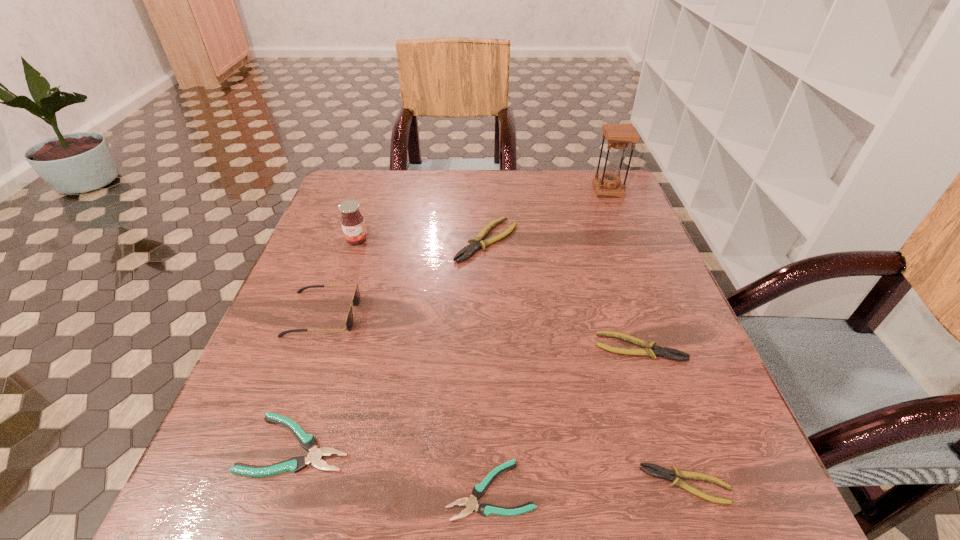
Locate an element on the screen. empty space between the left teal pliers and the nearest yellow pliers is located at coordinates (492, 464).

Identify the location of vacant space that is in between the tallest object and the smallest yellow pliers. (647, 338).

Find the location of a particular element. free spot between the jam and the second biggest yellow pliers is located at coordinates (498, 294).

I want to click on free point between the farthest object and the fourth shortest pliers, so click(624, 269).

You are a GUI agent. You are given a task and a screenshot of the screen. Output one action in this format:
    pyautogui.click(x=<x>, y=<y>)
    Task: Click on the free spot between the fourth tallest object and the jam
    The image size is (960, 540).
    Given the screenshot: What is the action you would take?
    pyautogui.click(x=421, y=240)

At what (x,y) coordinates should I click in order to perform the action: click on blank region between the left teal pliers and the smallest yellow pliers. Please return your answer as a coordinate pair (x, y). Looking at the image, I should click on (492, 464).

The height and width of the screenshot is (540, 960). Identify the location of object that is the second nearest to the farthest object. (649, 349).

Identify which object is the second closest to the sunglasses. Please provide its 2D coordinates. Your answer should be formatted as a tuple, i.e. [(x, y)], where the tuple contains the x and y coordinates of a point satisfying the conditions above.

[(308, 442)]

Where is `pliers that can be found as the third closest to the second tallest pliers`? pliers that can be found as the third closest to the second tallest pliers is located at coordinates 477,243.

Select which pliers appears as the fourth closest to the jam. Please provide its 2D coordinates. Your answer should be formatted as a tuple, i.e. [(x, y)], where the tuple contains the x and y coordinates of a point satisfying the conditions above.

[(485, 509)]